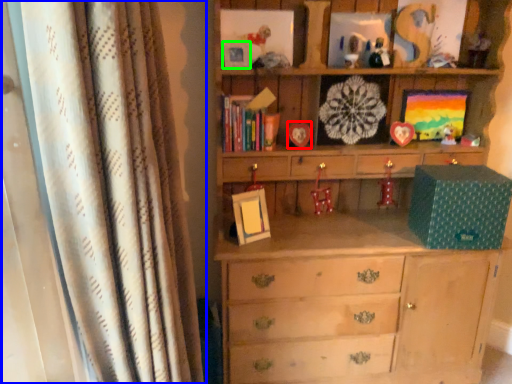
Question: Based on their relative distances, which object is nearer to picture frame (highlighted by a red box)? Choose from curtain (highlighted by a blue box) and picture frame (highlighted by a green box).

Choices:
 (A) curtain
 (B) picture frame

Answer: (B)